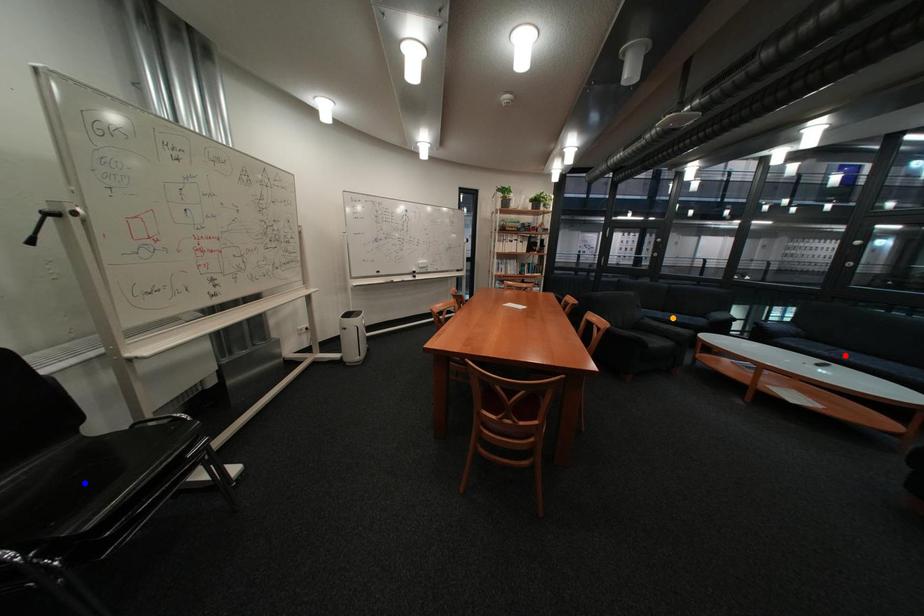
Order these from nearest to farthest:
red point, blue point, orange point

1. blue point
2. red point
3. orange point